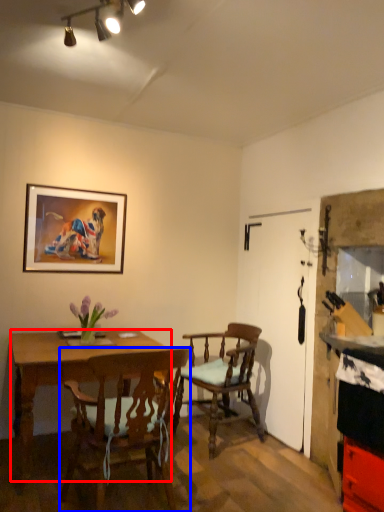
Question: Among these objects, which one is farthest to the camera, desk (highlighted by a red box) or chair (highlighted by a blue box)?

Choices:
 (A) desk
 (B) chair

Answer: (A)